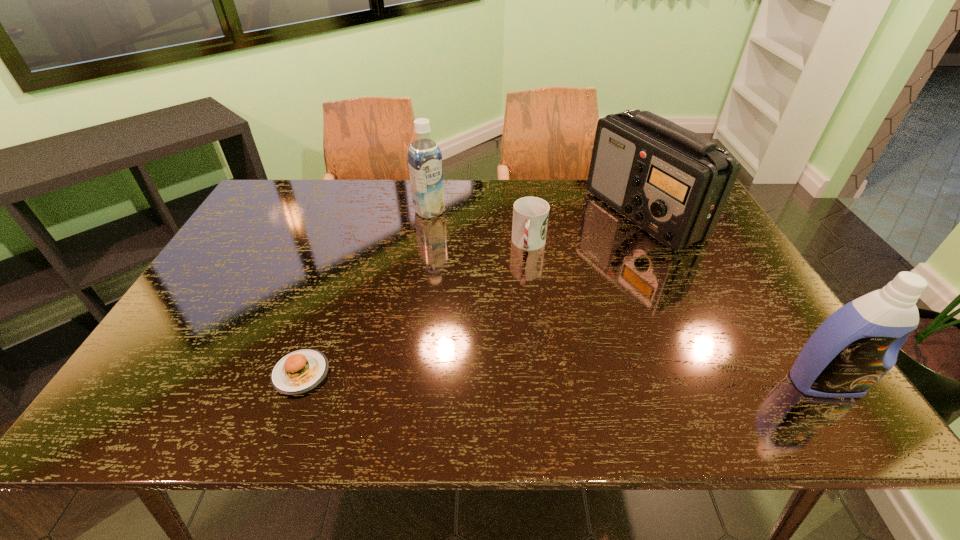
Identify the location of free location located 0.330m on the handle side of the fourth tallest object. (508, 350).

The height and width of the screenshot is (540, 960). In order to click on free location located on the handle side of the fourth tallest object in this screenshot , I will do `click(503, 371)`.

Where is `free space located 0.270m on the front panel of the radio receiver`? This screenshot has height=540, width=960. free space located 0.270m on the front panel of the radio receiver is located at coordinates (597, 304).

Where is `vacant region located 0.360m on the front panel of the radio receiver`? Image resolution: width=960 pixels, height=540 pixels. vacant region located 0.360m on the front panel of the radio receiver is located at coordinates (583, 327).

Where is `free spot located 0.080m on the front panel of the radio receiver`? free spot located 0.080m on the front panel of the radio receiver is located at coordinates (622, 263).

Where is `blank space located 0.390m on the label of the second object from left to right`? blank space located 0.390m on the label of the second object from left to right is located at coordinates pos(505,293).

You are a GUI agent. You are given a task and a screenshot of the screen. Output one action in this format:
    pyautogui.click(x=<x>, y=<y>)
    Task: Click on the vacant region located on the label of the second object from left to right
    
    Given the screenshot: What is the action you would take?
    pyautogui.click(x=477, y=263)

Find the location of a particular element. The height and width of the screenshot is (540, 960). vacant space located on the label of the second object from left to right is located at coordinates (505, 293).

The width and height of the screenshot is (960, 540). In order to click on radio receiver present at the far edge in this screenshot , I will do `click(673, 183)`.

Locate an element on the screen. The width and height of the screenshot is (960, 540). soya milk that is at the far edge is located at coordinates (425, 165).